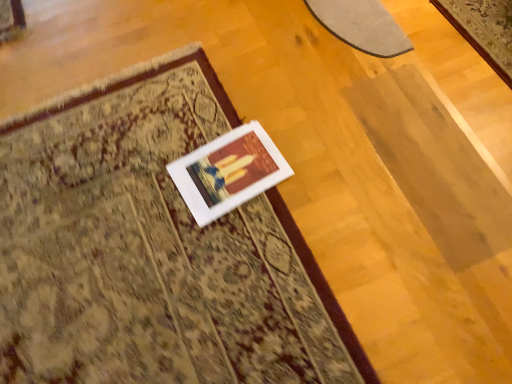
This screenshot has width=512, height=384. I want to click on free space to the left of white matte picture frame at center, so click(148, 185).